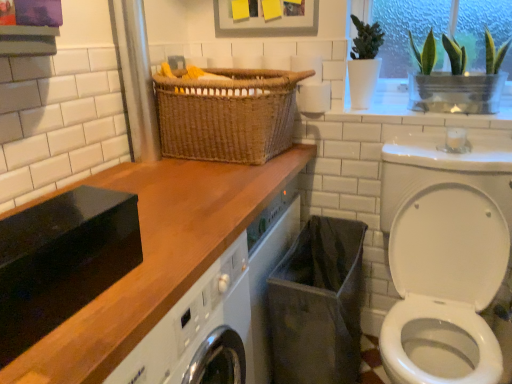
Identify the location of space that is in front of woven brown basket at center. (201, 187).